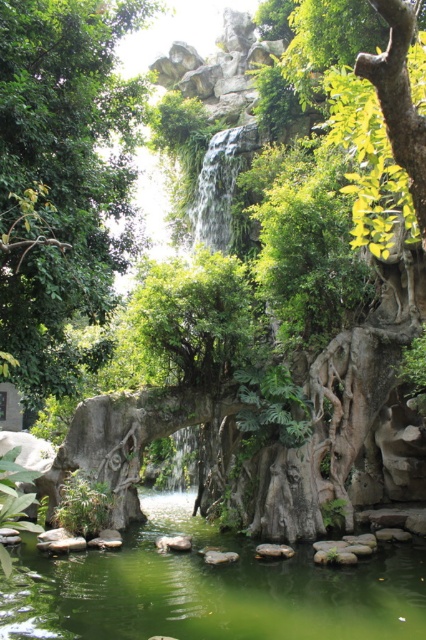
You are a gardener planning to install a new irrigation system in the garden. The system requires a water source within 20 meters of the target plant. If you want to water the green leafy tree at center, will the clear water at center be a suitable source based on their distance?

The distance between the green leafy tree at center and the clear water at center is 18.70 meters, which is within the 20 meters requirement. Therefore, the clear water at center can be used as a suitable water source for the green leafy tree at center.

You are standing in the garden and want to take a photo of the green leafy tree at center. If your camera has a maximum focus range of 8 meters, will it be able to focus on the tree?

The green leafy tree at center is 7.99 meters away from the camera, which is within the 8 meters maximum focus range. Therefore, the camera should be able to focus on the tree.